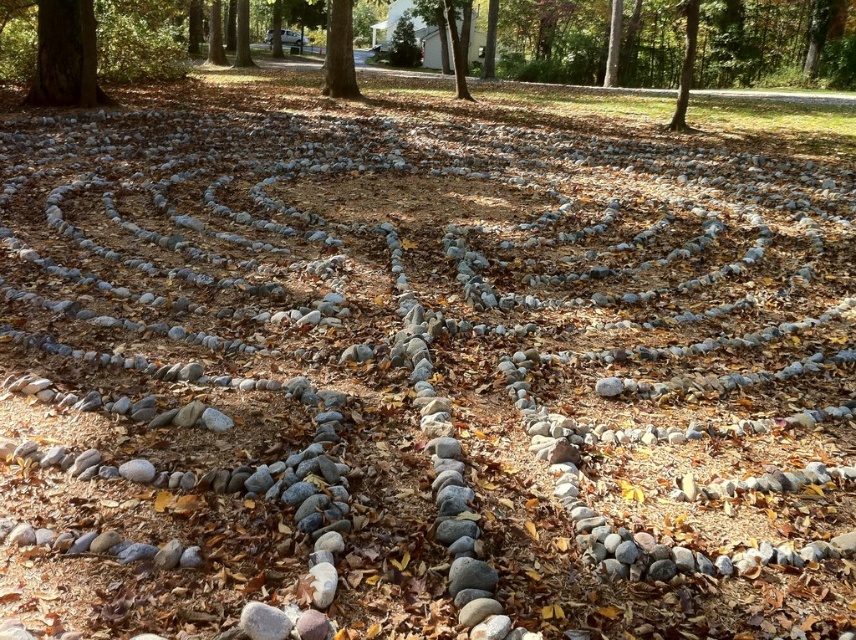
Question: Among these points, which one is farthest from the camera?

Choices:
 (A) (343, 16)
 (B) (453, 36)
 (C) (691, 74)
 (D) (247, 67)

Answer: (D)

Question: Does smooth bark tree at upper center have a greater width compared to green textured tree at upper right?

Choices:
 (A) no
 (B) yes

Answer: (A)

Question: Which point appears closest to the camera in this image?

Choices:
 (A) (242, 45)
 (B) (324, 83)
 (C) (675, 112)

Answer: (C)

Question: Does green textured tree at upper right lie behind green textured tree at upper center?

Choices:
 (A) yes
 (B) no

Answer: (B)

Question: Which object appears farthest from the camera in this image?

Choices:
 (A) green leafy tree at upper center
 (B) green textured tree at upper center
 (C) green leafy tree at center
 (D) green textured tree at upper right

Answer: (B)

Question: Is smooth bark tree at upper center positioned at the back of green leafy tree at center?

Choices:
 (A) yes
 (B) no

Answer: (B)